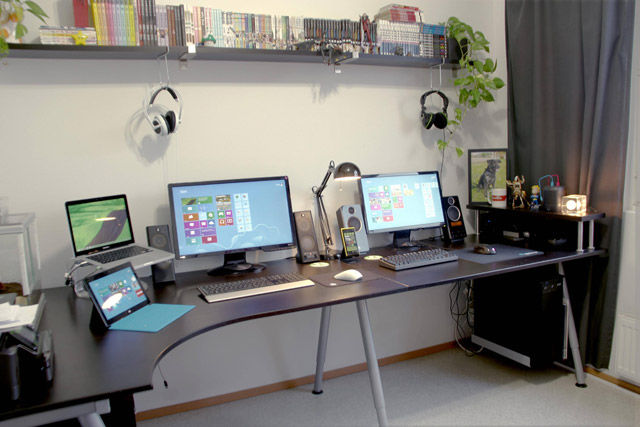
The width and height of the screenshot is (640, 427). What are the coordinates of `floor` in the screenshot? It's located at (496, 408).